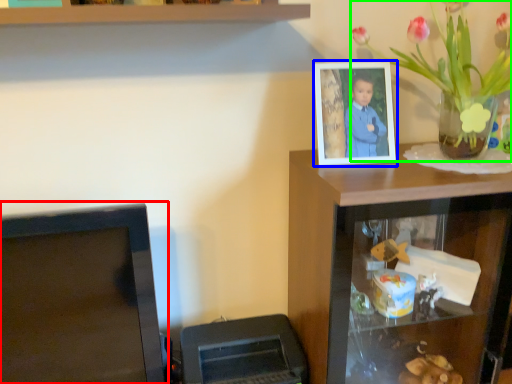
Question: Which object is the farthest from computer monitor (highlighted by a red box)? Choose among these: picture frame (highlighted by a blue box) or houseplant (highlighted by a green box).

Choices:
 (A) picture frame
 (B) houseplant

Answer: (B)